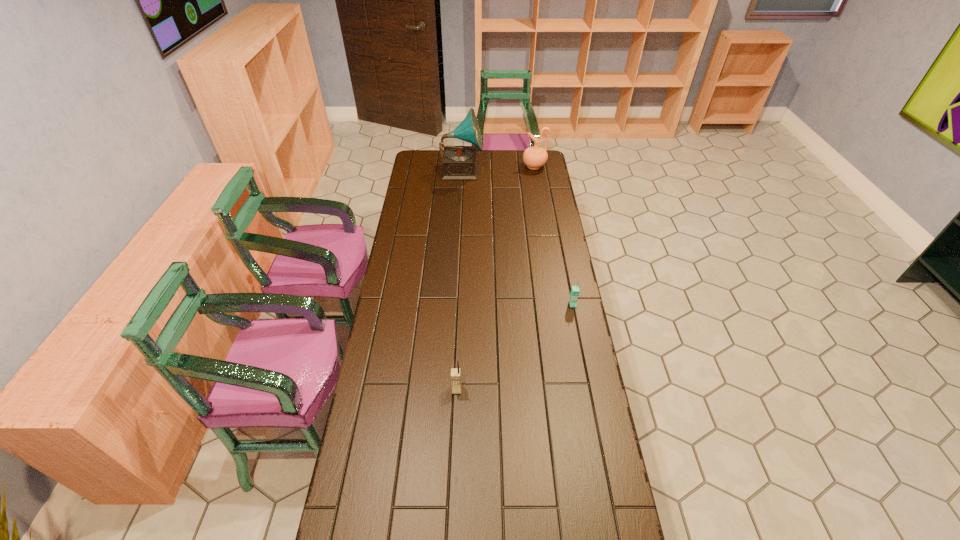
I want to click on free space located 0.310m on the front of the left cellular telephone, where the keypad is located, so click(452, 493).

Identify the location of vacant region located on the keypad of the shortest object. The height and width of the screenshot is (540, 960). (579, 334).

The width and height of the screenshot is (960, 540). Find the location of `record player located in the far edge section of the desktop`. record player located in the far edge section of the desktop is located at coordinates (460, 163).

You are a GUI agent. You are given a task and a screenshot of the screen. Output one action in this format:
    pyautogui.click(x=<x>, y=<y>)
    Task: Click on the pottery that is at the far edge
    This screenshot has width=960, height=540.
    Given the screenshot: What is the action you would take?
    pyautogui.click(x=535, y=157)

You are a GUI agent. You are given a task and a screenshot of the screen. Output one action in this format:
    pyautogui.click(x=<x>, y=<y>)
    Task: Click on the pottery that is positioned at the right edge
    The image size is (960, 540).
    Given the screenshot: What is the action you would take?
    pyautogui.click(x=535, y=157)

The image size is (960, 540). I want to click on cellular telephone that is at the right edge, so point(574,294).

This screenshot has width=960, height=540. In order to click on object located at the far right corner in this screenshot , I will do `click(535, 157)`.

In the image, there is a desktop. Find the location of `vacant region at the left edge`. vacant region at the left edge is located at coordinates (411, 186).

The image size is (960, 540). In the image, there is a desktop. In order to click on vacant area at the right edge in this screenshot , I will do `click(598, 483)`.

In the image, there is a desktop. Identify the location of vacant space at the far left corner. Image resolution: width=960 pixels, height=540 pixels. (428, 162).